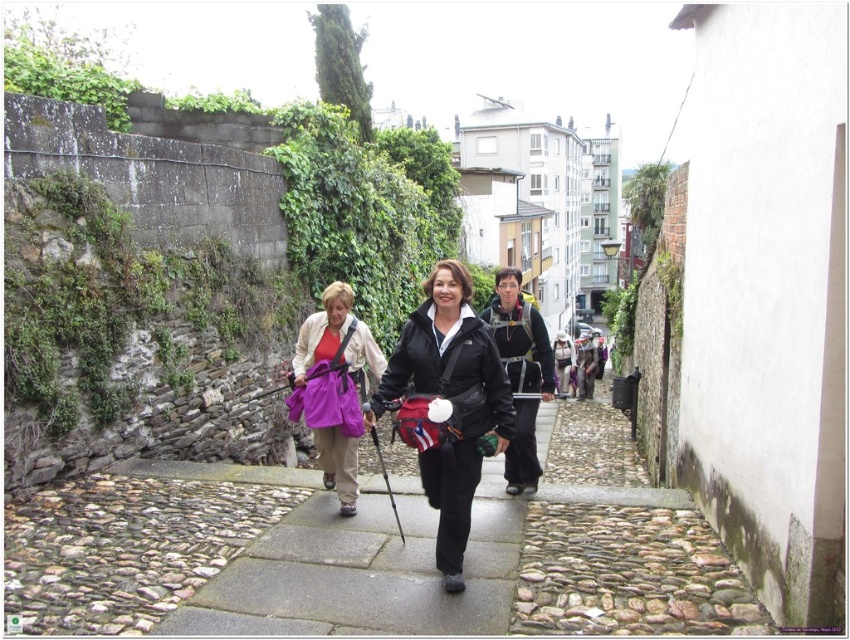
Is black matte jacket at center bigger than matte purple backpack at center?

No, black matte jacket at center is not bigger than matte purple backpack at center.

Can you confirm if black matte jacket at center is taller than matte purple backpack at center?

Yes, black matte jacket at center is taller than matte purple backpack at center.

Locate an element on the screen. The height and width of the screenshot is (640, 850). black matte jacket at center is located at coordinates (450, 403).